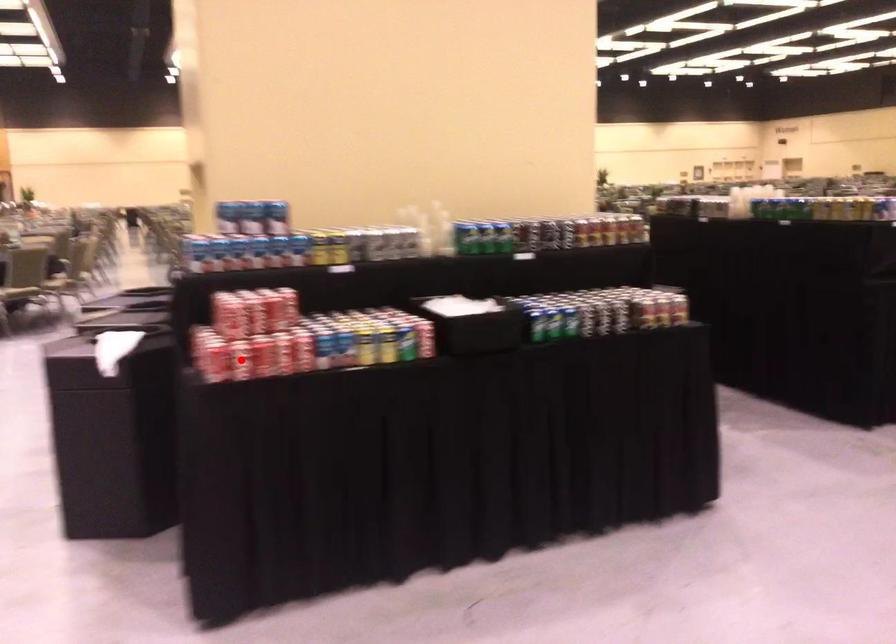
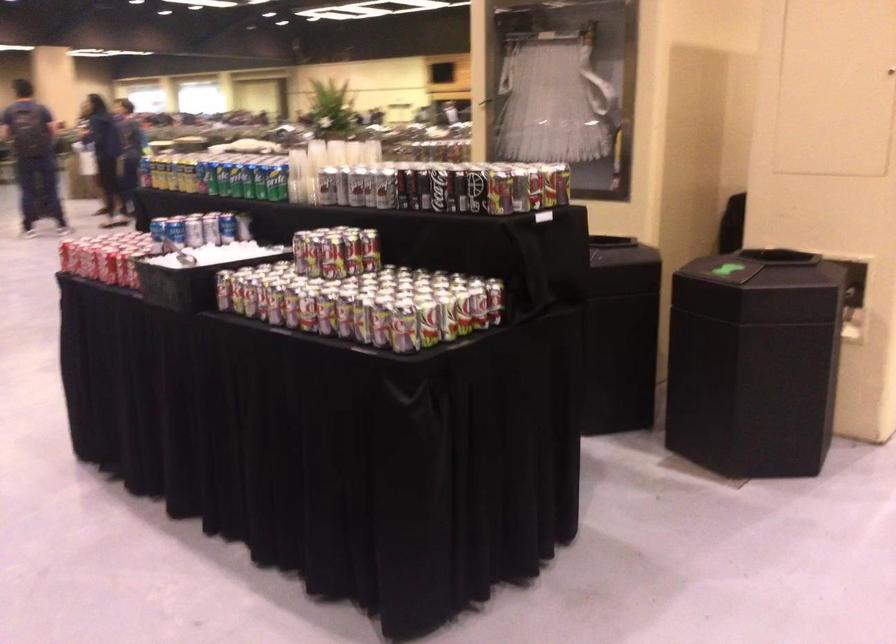
Question: I am providing you with two images of the same scene from different viewpoints. A red point is marked on the first image. Can you still see the location of the red point in image 2?

Choices:
 (A) Yes
 (B) No

Answer: (B)